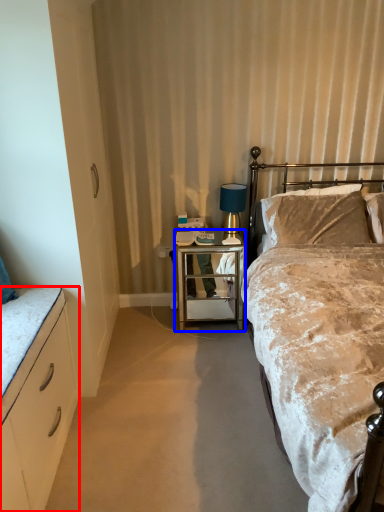
Question: Which object is closer to the camera taking this photo, cabinetry (highlighted by a red box) or desk (highlighted by a blue box)?

Choices:
 (A) cabinetry
 (B) desk

Answer: (A)